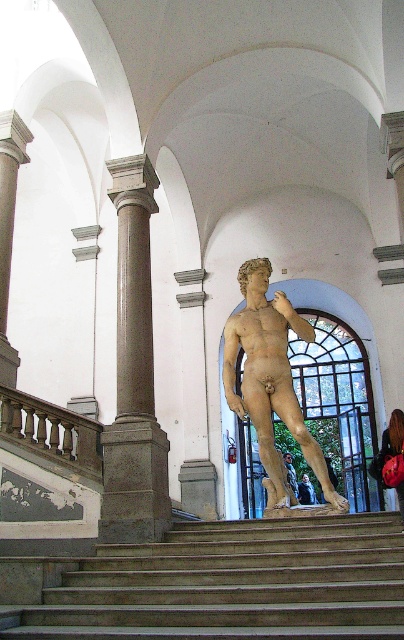
Question: Among these objects, which one is farthest from the camera?

Choices:
 (A) brown stone column at left
 (B) smooth concrete stairs at center
 (C) bronze statue at center
 (D) polished bronze statue at center

Answer: (C)

Question: Can you confirm if dark brown polished wood railing at left is smaller than bronze statue at center?

Choices:
 (A) no
 (B) yes

Answer: (B)

Question: Estimate the real-world distances between objects in this image. Which object is closer to the bronze statue at center?

Choices:
 (A) dark brown polished wood railing at left
 (B) brown stone column at left

Answer: (A)

Question: Does polished bronze statue at center have a greater width compared to dark brown polished wood railing at left?

Choices:
 (A) no
 (B) yes

Answer: (B)

Question: Which point is closer to the camera?

Choices:
 (A) (29, 417)
 (B) (281, 342)

Answer: (A)

Question: Is polished bronze statue at center above dark brown polished wood railing at left?

Choices:
 (A) no
 (B) yes

Answer: (B)